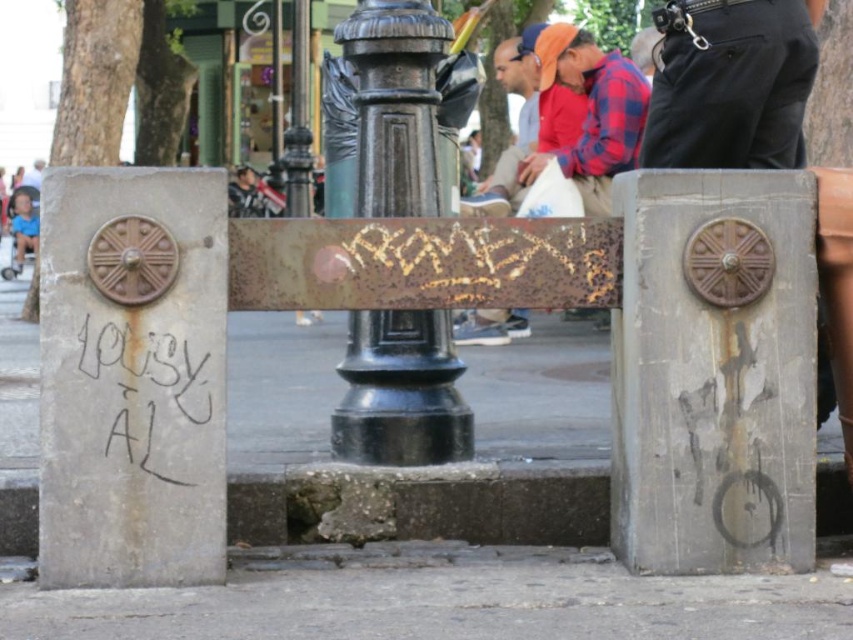
Question: Does black polished metal pole at center appear over blue denim shorts at left?

Choices:
 (A) no
 (B) yes

Answer: (B)

Question: Among these objects, which one is farthest from the camera?

Choices:
 (A) gray concrete pavement at lower center
 (B) black polished metal pole at center
 (C) rusty metal pole at center
 (D) blue denim shorts at left

Answer: (D)

Question: Does rusty metal pole at center have a lesser width compared to blue denim shorts at left?

Choices:
 (A) yes
 (B) no

Answer: (A)

Question: Which of these objects is positioned closest to the gray concrete pavement at lower center?

Choices:
 (A) concrete at lower left
 (B) black polished metal pole at center
 (C) blue denim shorts at left
 (D) rusty metal pole at center

Answer: (A)

Question: Can you confirm if concrete at lower left is smaller than rusty metal pole at center?

Choices:
 (A) no
 (B) yes

Answer: (B)

Question: Which object is farther from the camera taking this photo?

Choices:
 (A) rusty metal pole at center
 (B) gray concrete pavement at lower center

Answer: (A)